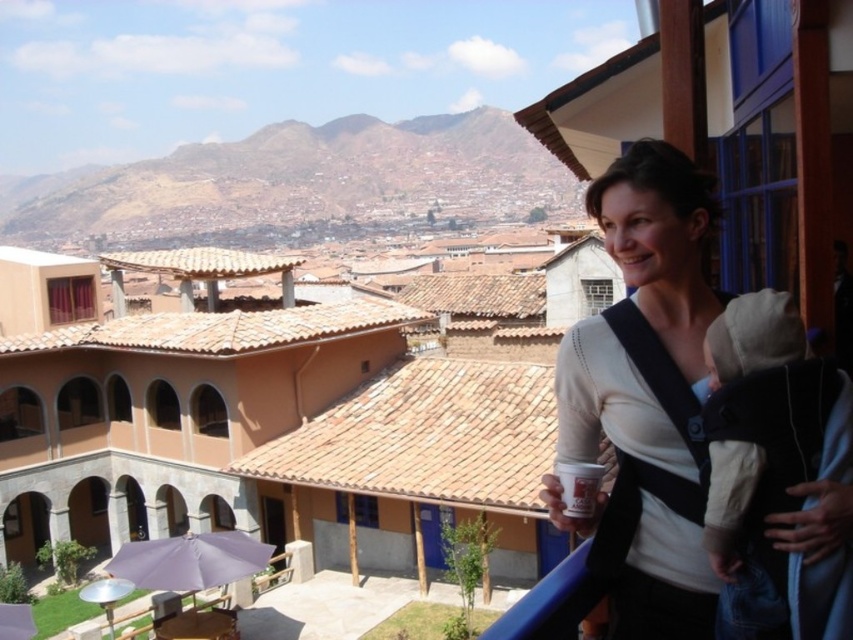
Measure the distance from white matte sweater at upper right to purple fabric umbrella at lower left.

white matte sweater at upper right and purple fabric umbrella at lower left are 15.25 meters apart.

Does white matte sweater at upper right have a greater width compared to purple fabric umbrella at lower left?

Yes, white matte sweater at upper right is wider than purple fabric umbrella at lower left.

Between point (572, 364) and point (190, 554), which one is positioned in front?

Positioned in front is point (572, 364).

You are a GUI agent. You are given a task and a screenshot of the screen. Output one action in this format:
    pyautogui.click(x=<x>, y=<y>)
    Task: Click on the white matte sweater at upper right
    This screenshot has height=640, width=853.
    Given the screenshot: What is the action you would take?
    coord(648,385)